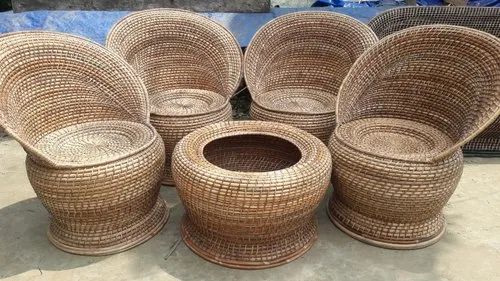
Where is `rightmost chair seat`? The width and height of the screenshot is (500, 281). rightmost chair seat is located at coordinates (392, 136).